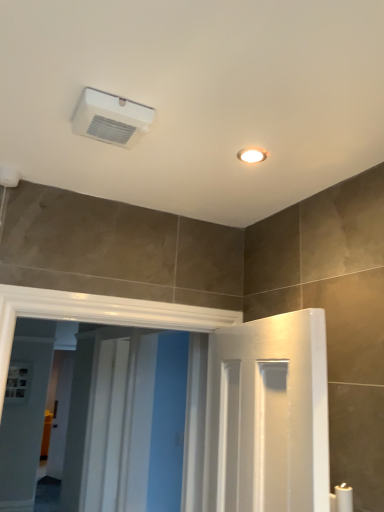
Question: Do you think white glossy screen door at center, the 2th screen door in the back-to-front sequence, is within white plastic air conditioning unit at upper center, or outside of it?

Choices:
 (A) inside
 (B) outside

Answer: (B)

Question: In the image, is white glossy screen door at center, which ranks as the first screen door in front-to-back order, on the left side or the right side of white plastic air conditioning unit at upper center?

Choices:
 (A) right
 (B) left

Answer: (B)

Question: Which is nearer to the white glossy screen door at center, the 2th screen door in the back-to-front sequence?

Choices:
 (A) white glossy screen door at center, arranged as the 1th screen door when viewed from the back
 (B) white plastic air conditioning unit at upper center

Answer: (A)

Question: Considering the real-world distances, which object is closest to the white glossy screen door at center, arranged as the 2th screen door when viewed from the front?

Choices:
 (A) white plastic air conditioning unit at upper center
 (B) white glossy screen door at center, the 2th screen door in the back-to-front sequence

Answer: (B)